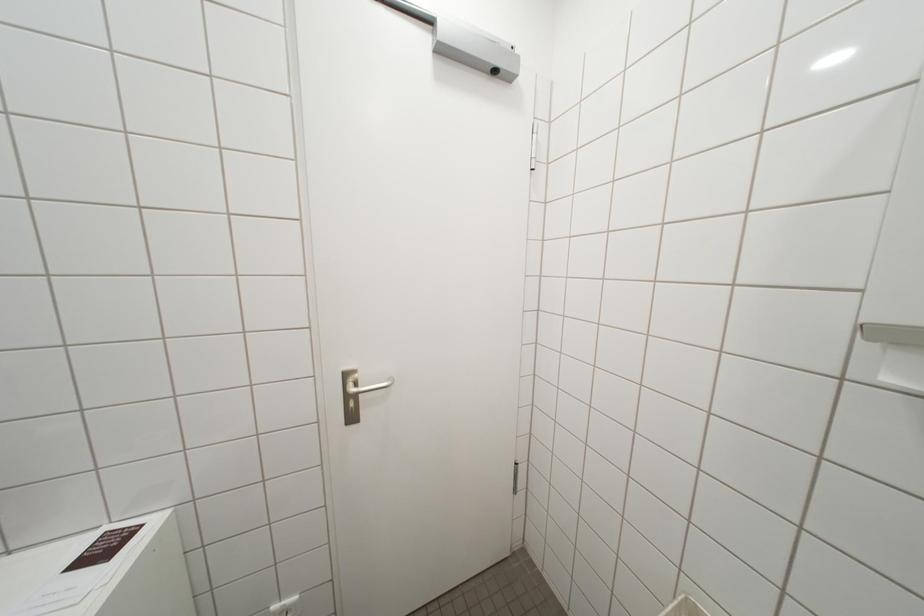
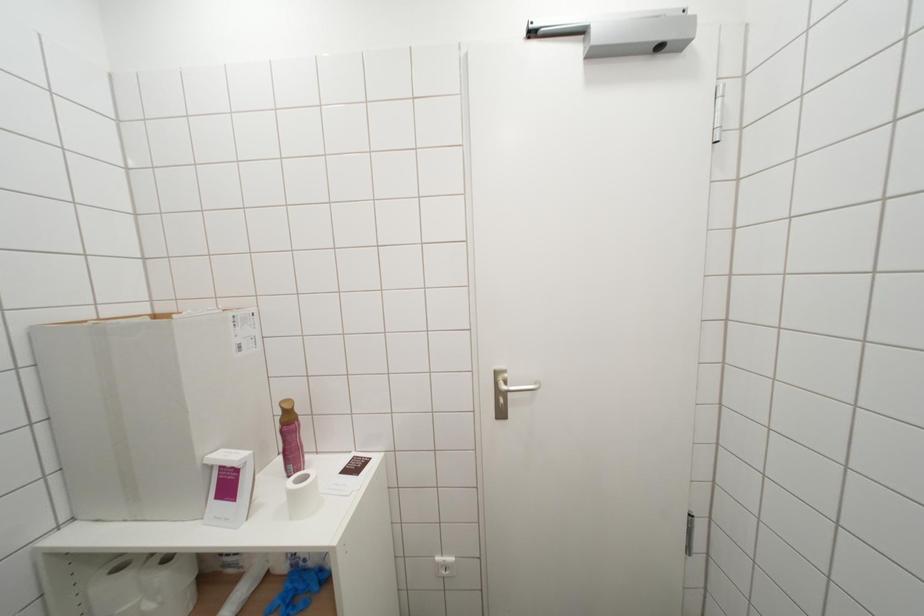
Question: The camera is either moving clockwise (left) or counter-clockwise (right) around the object. The first image is from the beginning of the video and the second image is from the end. Is the camera moving left or right when shooting the video?

Choices:
 (A) Left
 (B) Right

Answer: (B)